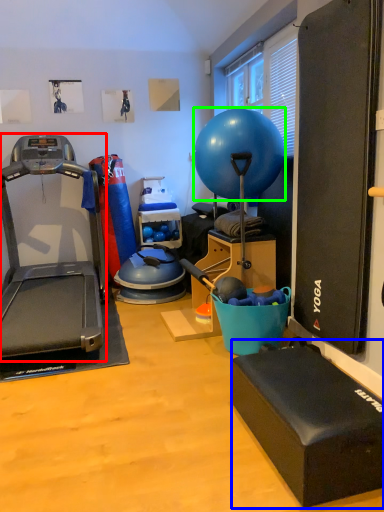
Question: Based on their relative distances, which object is nearer to treadmill (highlighted by a red box)? Choose from box (highlighted by a blue box) and ball (highlighted by a green box).

Choices:
 (A) box
 (B) ball

Answer: (B)